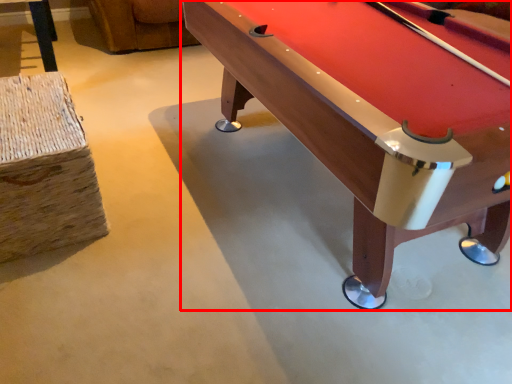
Question: From the image's perspective, where is billiard table (annotated by the red box) located relative to bar stool?

Choices:
 (A) below
 (B) above

Answer: (B)